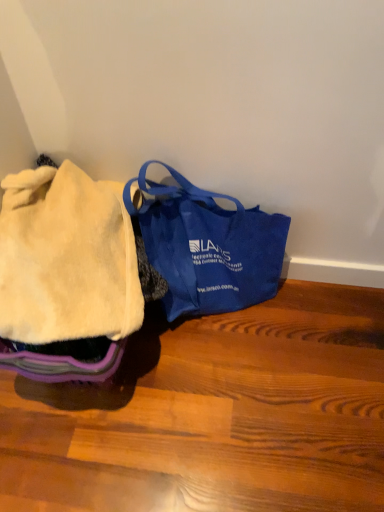
In order to click on blue canvas bag at center in this screenshot , I will do `click(207, 246)`.

What do you see at coordinates (207, 246) in the screenshot? The image size is (384, 512). I see `blue canvas bag at center` at bounding box center [207, 246].

Measure the distance between point (x=125, y=201) and camera.

Point (x=125, y=201) and camera are 1.01 meters apart.

In order to face blue canvas bag at center, should I rotate leftwards or rightwards?

Turn right by 2.420 degrees to look at blue canvas bag at center.

Describe the element at coordinates (66, 258) in the screenshot. The height and width of the screenshot is (512, 384). I see `fuzzy cream blanket at left` at that location.

At what (x,y) coordinates should I click in order to perform the action: click on fuzzy cream blanket at left. Please return your answer as a coordinate pair (x, y). Looking at the image, I should click on (66, 258).

Where is `blue canvas bag at center`? blue canvas bag at center is located at coordinates (207, 246).

Which is more to the left, blue canvas bag at center or fuzzy cream blanket at left?

From the viewer's perspective, fuzzy cream blanket at left appears more on the left side.

Considering the relative positions of blue canvas bag at center and fuzzy cream blanket at left in the image provided, is blue canvas bag at center in front of fuzzy cream blanket at left?

No, blue canvas bag at center is behind fuzzy cream blanket at left.

Which is less distant, (194, 272) or (53, 252)?

Point (194, 272) is farther from the camera than point (53, 252).

From the image's perspective, is blue canvas bag at center above or below fuzzy cream blanket at left?

Based on their image positions, blue canvas bag at center is located beneath fuzzy cream blanket at left.

Consider the image. From a real-world perspective, between blue canvas bag at center and fuzzy cream blanket at left, who is vertically lower?

In real-world perspective, blue canvas bag at center is lower.

Can you confirm if blue canvas bag at center is wider than fuzzy cream blanket at left?

Incorrect, the width of blue canvas bag at center does not surpass that of fuzzy cream blanket at left.

Considering the sizes of objects blue canvas bag at center and fuzzy cream blanket at left in the image provided, who is taller, blue canvas bag at center or fuzzy cream blanket at left?

blue canvas bag at center.

Considering the sizes of objects blue canvas bag at center and fuzzy cream blanket at left in the image provided, who is bigger, blue canvas bag at center or fuzzy cream blanket at left?

With larger size is blue canvas bag at center.

Would you say fuzzy cream blanket at left is part of blue canvas bag at center's contents?

No.

Based on the photo, are blue canvas bag at center and fuzzy cream blanket at left beside each other?

No, blue canvas bag at center is not in contact with fuzzy cream blanket at left.

Is blue canvas bag at center looking in the opposite direction of fuzzy cream blanket at left?

No, blue canvas bag at center is not facing away from fuzzy cream blanket at left.

How many degrees apart are the facing directions of blue canvas bag at center and fuzzy cream blanket at left?

0.000934 degrees.

In order to click on handbag below the fuzzy cream blanket at left (from the image's perspective) in this screenshot , I will do `click(207, 246)`.

In the image, is fuzzy cream blanket at left on the left side or the right side of blue canvas bag at center?

fuzzy cream blanket at left is to the left of blue canvas bag at center.

Which object is closer to the camera, fuzzy cream blanket at left or blue canvas bag at center?

fuzzy cream blanket at left.

Which point is more forward, (100, 249) or (153, 219)?

The point (100, 249) is more forward.

From the image's perspective, who appears lower, fuzzy cream blanket at left or blue canvas bag at center?

From the image's view, blue canvas bag at center is below.

From a real-world perspective, is fuzzy cream blanket at left over blue canvas bag at center?

Correct, in the physical world, fuzzy cream blanket at left is higher than blue canvas bag at center.

Can you confirm if fuzzy cream blanket at left is wider than blue canvas bag at center?

→ Correct, the width of fuzzy cream blanket at left exceeds that of blue canvas bag at center.

Can you confirm if fuzzy cream blanket at left is shorter than blue canvas bag at center?

Indeed, fuzzy cream blanket at left has a lesser height compared to blue canvas bag at center.

Looking at the image, does fuzzy cream blanket at left seem bigger or smaller compared to blue canvas bag at center?

Considering their sizes, fuzzy cream blanket at left takes up less space than blue canvas bag at center.

Is fuzzy cream blanket at left positioned beyond the bounds of blue canvas bag at center?

Yes, fuzzy cream blanket at left is outside of blue canvas bag at center.

Consider the image. Is fuzzy cream blanket at left positioned far away from blue canvas bag at center?

No, fuzzy cream blanket at left is not far away from blue canvas bag at center.

Is blue canvas bag at center at the back of fuzzy cream blanket at left?

No, fuzzy cream blanket at left's orientation is not away from blue canvas bag at center.

How far apart are fuzzy cream blanket at left and blue canvas bag at center?

The distance of fuzzy cream blanket at left from blue canvas bag at center is 8.88 inches.

There is a blue canvas bag at center. What are the coordinates of `cloth above it (from a real-world perspective)` in the screenshot? It's located at (66, 258).

Locate an element on the screen. Image resolution: width=384 pixels, height=512 pixels. handbag on the right of fuzzy cream blanket at left is located at coordinates (207, 246).

Locate an element on the screen. cloth that appears on the left of blue canvas bag at center is located at coordinates (66, 258).